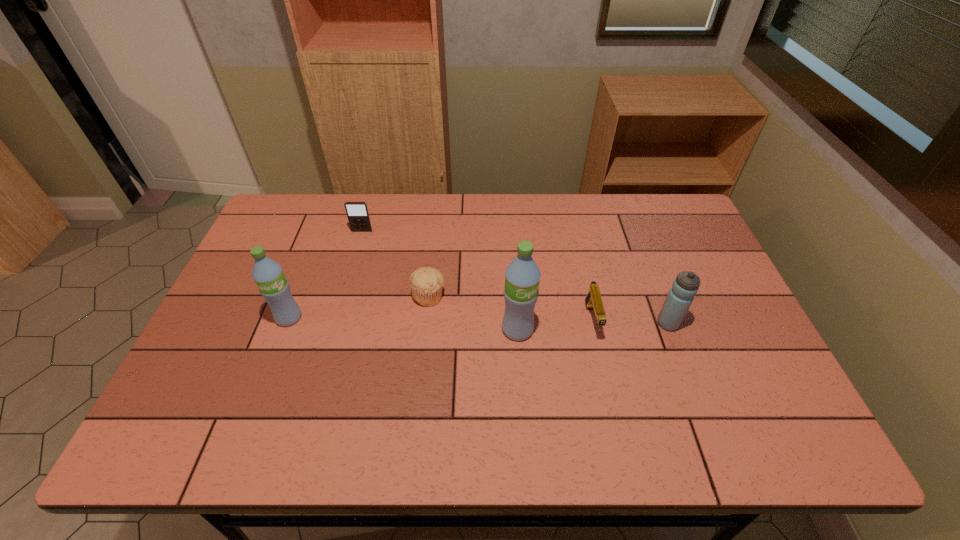
I want to click on vacant region located on the front of the second tallest water bottle, so click(279, 343).

What are the coordinates of `vacant space located on the front of the tallest water bottle` in the screenshot? It's located at (522, 395).

Identify the location of vacant space located 0.350m on the front-facing side of the farthest object. This screenshot has width=960, height=540. (338, 315).

Identify the location of free space located 0.170m at the barrel of the fifth object from left to right. The width and height of the screenshot is (960, 540). (611, 402).

Find the location of `free location located 0.400m on the right of the third object from left to right`. free location located 0.400m on the right of the third object from left to right is located at coordinates (586, 295).

Find the location of a particular element. vacant space located on the back of the fourth shortest object is located at coordinates (657, 293).

The image size is (960, 540). In order to click on object that is positioned at the far edge in this screenshot , I will do `click(358, 216)`.

I want to click on object present at the left edge, so tap(268, 274).

You are a GUI agent. You are given a task and a screenshot of the screen. Output one action in this format:
    pyautogui.click(x=<x>, y=<y>)
    Task: Click on the vacant space at the far edge of the desktop
    The height and width of the screenshot is (540, 960).
    Given the screenshot: What is the action you would take?
    pyautogui.click(x=460, y=224)

The height and width of the screenshot is (540, 960). In order to click on blank space at the near edge in this screenshot , I will do click(x=354, y=408).